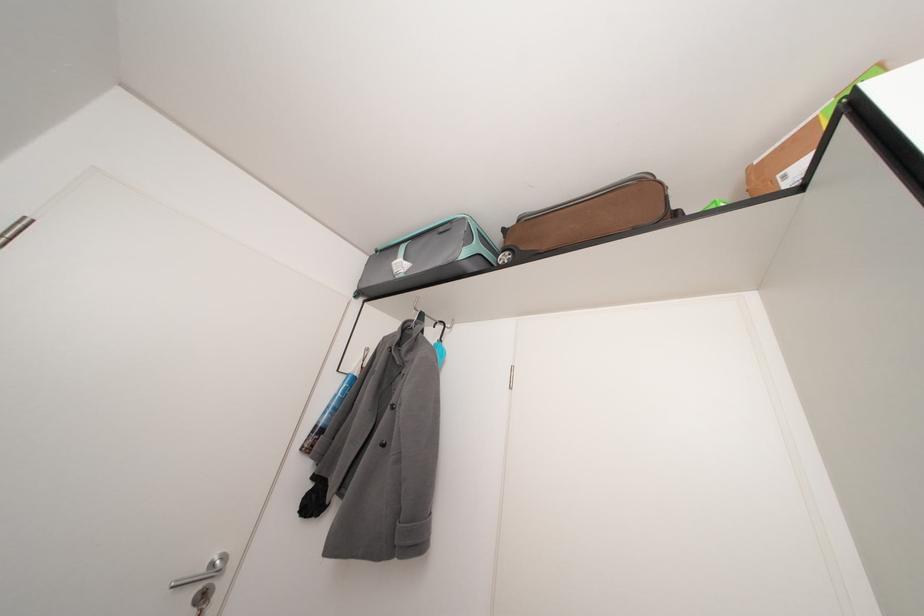
Describe the element at coordinates (203, 570) in the screenshot. Image resolution: width=924 pixels, height=616 pixels. I see `a silver door handle` at that location.